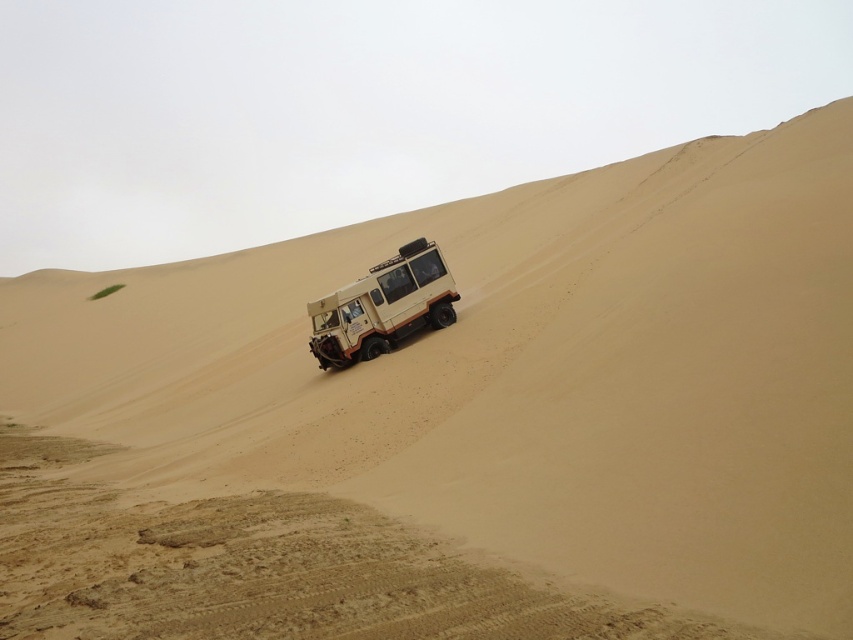
Question: Is brown sandy dirt track at lower center closer to the viewer compared to beige matte jeep at center?

Choices:
 (A) no
 (B) yes

Answer: (B)

Question: Can you confirm if brown sandy dirt track at lower center is smaller than beige matte jeep at center?

Choices:
 (A) no
 (B) yes

Answer: (A)

Question: Among these points, which one is farthest from the camera?

Choices:
 (A) (355, 323)
 (B) (181, 589)

Answer: (A)

Question: Which of the following is the closest to the observer?

Choices:
 (A) (445, 284)
 (B) (196, 582)

Answer: (B)

Question: Is brown sandy dirt track at lower center wider than beige matte jeep at center?

Choices:
 (A) yes
 (B) no

Answer: (A)